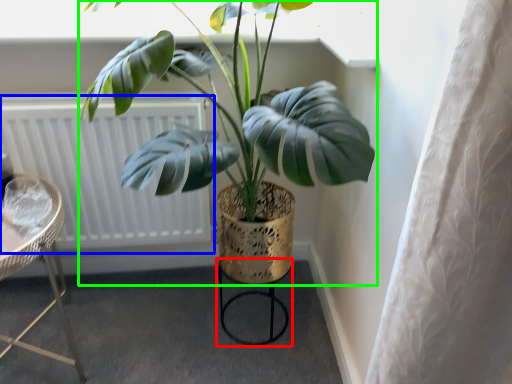
Question: Based on their relative distances, which object is farther from bar stool (highlighted by a red box)? Choose from radiator (highlighted by a blue box) and houseplant (highlighted by a green box).

Choices:
 (A) radiator
 (B) houseplant

Answer: (B)